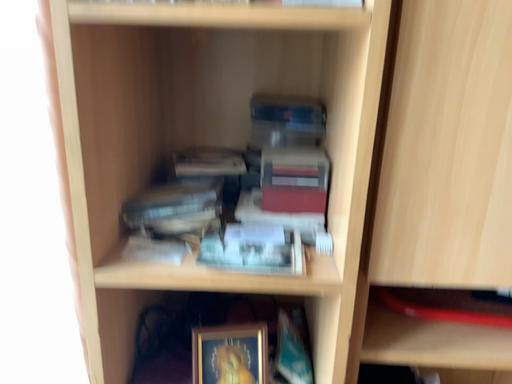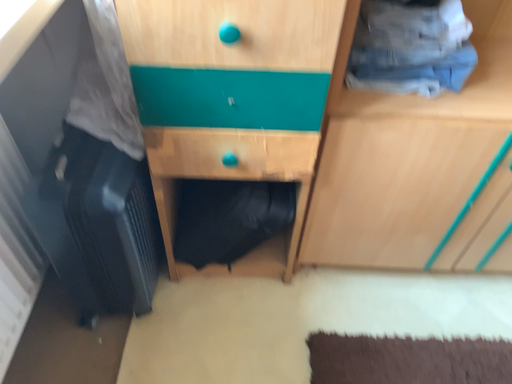
Question: Which way did the camera rotate in the video?

Choices:
 (A) rotated downward
 (B) rotated upward

Answer: (A)